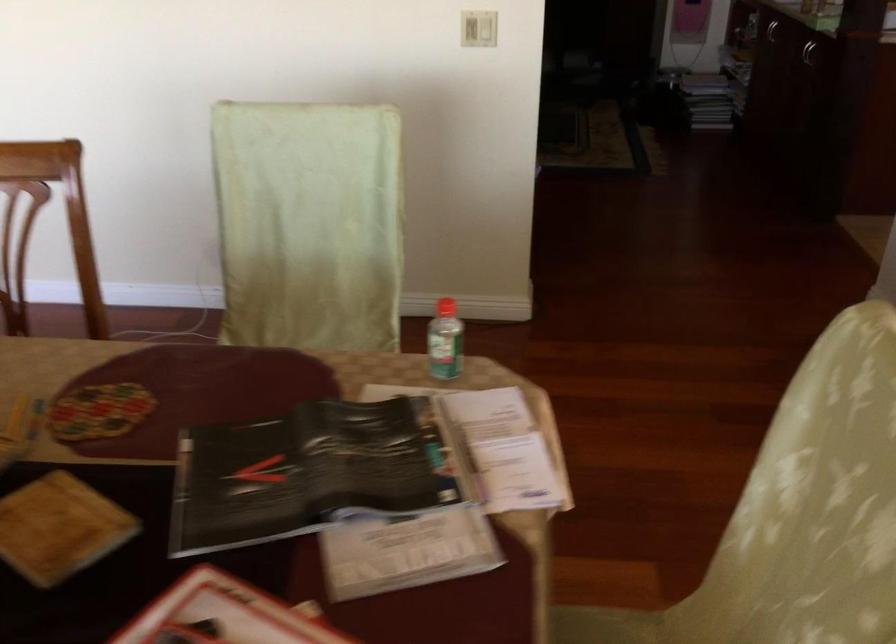
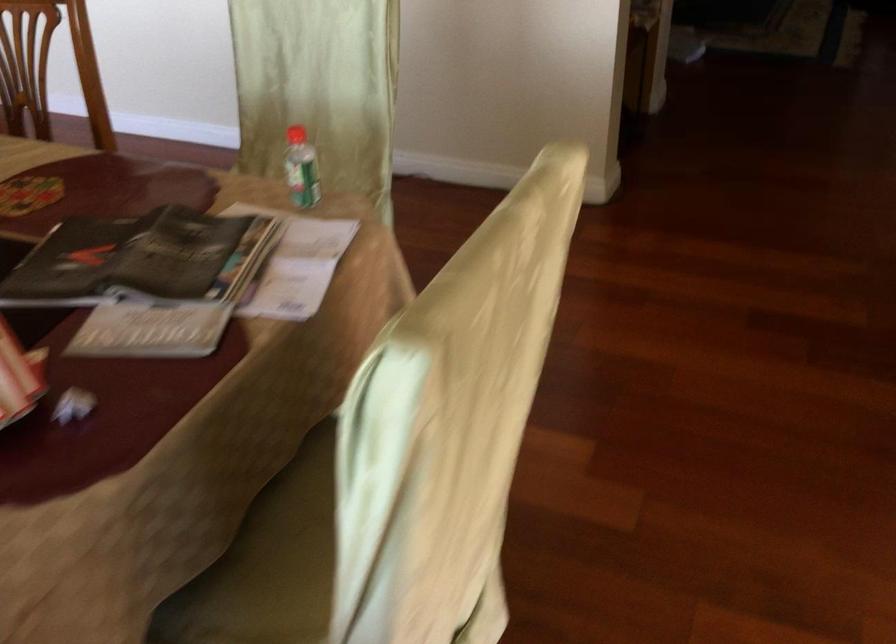
Question: Which direction would the cameraman need to move to produce the second image? Reply with the corresponding letter.

Choices:
 (A) Left
 (B) Right
 (C) Forward
 (D) Backward

Answer: (B)